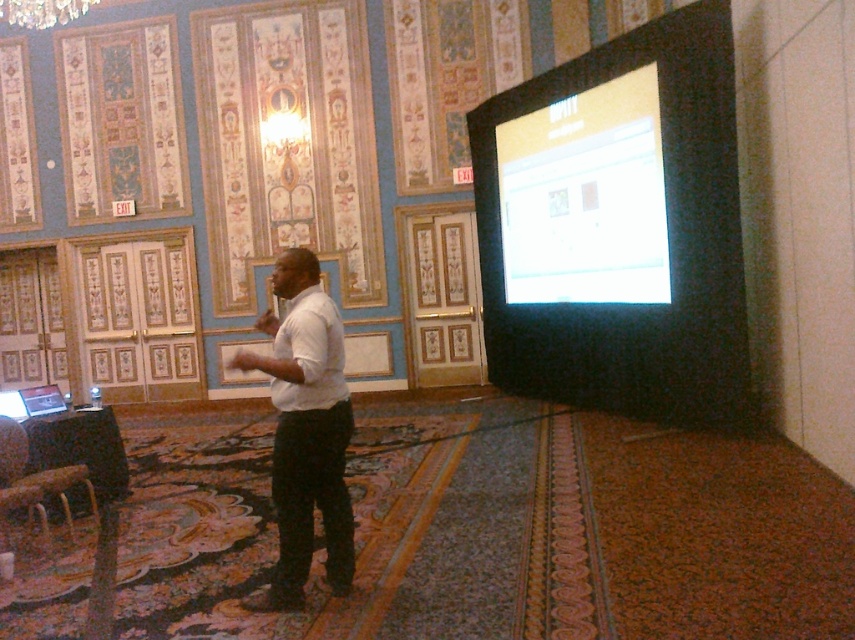
From the picture: Can you confirm if matte black screen at right is smaller than white matte shirt at center?

Actually, matte black screen at right might be larger than white matte shirt at center.

Does matte black screen at right have a lesser height compared to white matte shirt at center?

No.

What do you see at coordinates (653, 227) in the screenshot? I see `matte black screen at right` at bounding box center [653, 227].

Locate an element on the screen. This screenshot has width=855, height=640. matte black screen at right is located at coordinates (653, 227).

Which is more to the left, matte black screen at right or white glossy screen at upper right?

Positioned to the left is white glossy screen at upper right.

Which is behind, point (618, 365) or point (640, 84)?

The point (618, 365) is more distant.

Measure the distance between point (x=706, y=22) and camera.

Point (x=706, y=22) and camera are 5.42 meters apart from each other.

Where is `matte black screen at right`? The width and height of the screenshot is (855, 640). matte black screen at right is located at coordinates (653, 227).

Which is below, white glossy screen at upper right or white matte shirt at center?

white matte shirt at center

Between white glossy screen at upper right and white matte shirt at center, which one appears on the left side from the viewer's perspective?

From the viewer's perspective, white matte shirt at center appears more on the left side.

Is point (564, 284) positioned behind point (346, 541)?

That is True.

You are a GUI agent. You are given a task and a screenshot of the screen. Output one action in this format:
    pyautogui.click(x=<x>, y=<y>)
    Task: Click on the white glossy screen at upper right
    
    Given the screenshot: What is the action you would take?
    pyautogui.click(x=585, y=196)